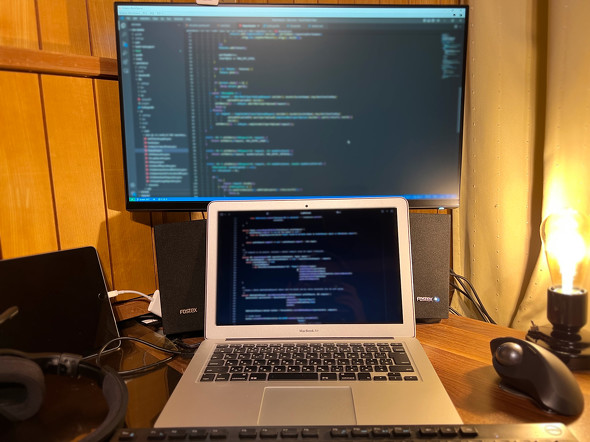
Where is `mouse`? mouse is located at coordinates (536, 368).